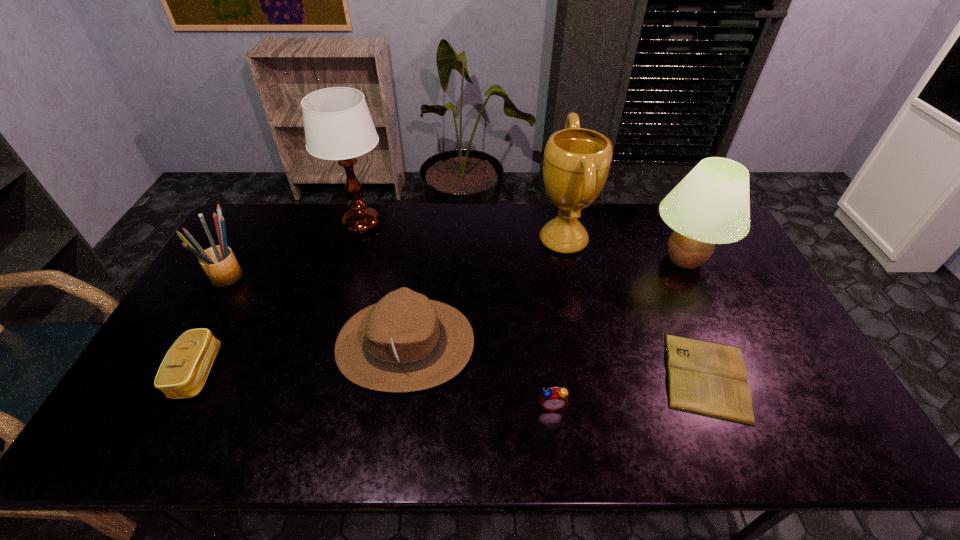
Locate which object is the closest to the award. Please provide its 2D coordinates. Your answer should be formatted as a tuple, i.e. [(x, y)], where the tuple contains the x and y coordinates of a point satisfying the conditions above.

[(711, 205)]

Identify the location of vacant region that satisfies the following two spatial constraints: 1. on the shade of the lampshade; 2. on the feather side of the fedora. The image size is (960, 540). (726, 344).

The image size is (960, 540). In order to click on free location that satisfies the following two spatial constraints: 1. on the front of the award with the decoration; 2. on the front-facing side of the alarm clock in this screenshot , I will do (598, 405).

Identify the location of free space in the image that satisfies the following two spatial constraints: 1. on the feather side of the book; 2. on the left side of the fifth tallest object. click(401, 376).

Locate an element on the screen. Image resolution: width=960 pixels, height=540 pixels. free location that satisfies the following two spatial constraints: 1. on the front side of the table lamp; 2. on the zipper side of the clutch bag is located at coordinates (317, 372).